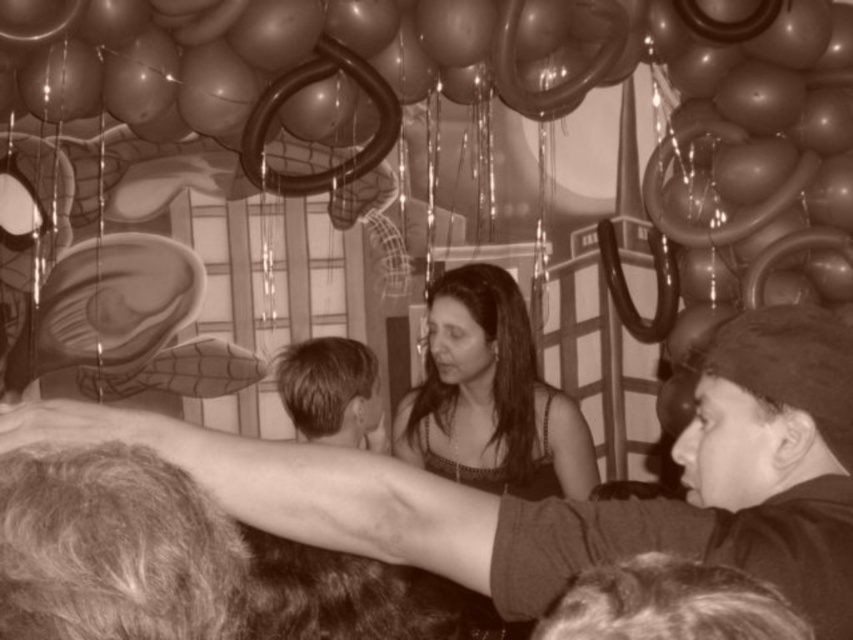
You are at a party with a Spiderman theme. You see a matte black dress at center and a dark brown hair at center. Which one has a greater width?

The matte black dress at center has a greater width than the dark brown hair at center.

You are at a party with a Spiderman theme. You see a matte black dress at center and dark brown hair at center. Which object is higher in the image?

The matte black dress at center is higher than dark brown hair at center in the image.

You are at a party and see the matte black dress at center and dark brown hair at center. Which one is taller?

The matte black dress at center is much taller as dark brown hair at center.